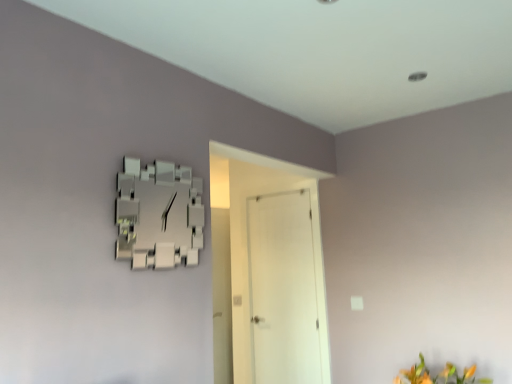
Question: Is white matte door at center bigger or smaller than orange matte flower at lower right?

Choices:
 (A) big
 (B) small

Answer: (A)

Question: Is white matte door at center taller or shorter than orange matte flower at lower right?

Choices:
 (A) tall
 (B) short

Answer: (A)

Question: From a real-world perspective, relative to orange matte flower at lower right, is white matte door at center vertically above or below?

Choices:
 (A) above
 (B) below

Answer: (A)

Question: From the image's perspective, is orange matte flower at lower right positioned above or below white matte door at center?

Choices:
 (A) above
 (B) below

Answer: (B)

Question: From a real-world perspective, is orange matte flower at lower right above or below white matte door at center?

Choices:
 (A) below
 (B) above

Answer: (A)

Question: Is orange matte flower at lower right in front of or behind white matte door at center in the image?

Choices:
 (A) front
 (B) behind

Answer: (A)

Question: Based on their positions, is orange matte flower at lower right located to the left or right of white matte door at center?

Choices:
 (A) left
 (B) right

Answer: (B)